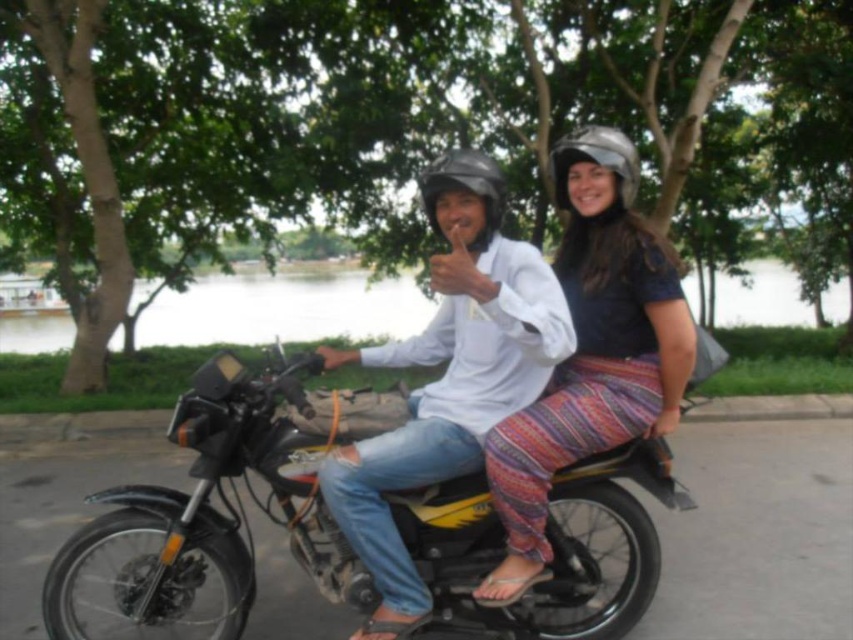
Question: Can you confirm if black matte motorcycle at center is positioned to the right of matte black helmet at center?

Choices:
 (A) no
 (B) yes

Answer: (A)

Question: Which of the following is the farthest from the observer?

Choices:
 (A) multicolored woven pants at center
 (B) black matte motorcycle at center
 (C) white matte shirt at center
 (D) matte black helmet at center

Answer: (D)

Question: Does black matte motorcycle at center appear under metallic silver helmet at upper right?

Choices:
 (A) yes
 (B) no

Answer: (A)

Question: Which of the following is the farthest from the observer?

Choices:
 (A) metallic silver helmet at upper right
 (B) black matte motorcycle at center
 (C) white matte shirt at center
 (D) matte black helmet at center

Answer: (A)

Question: Which object is the closest to the multicolored woven pants at center?

Choices:
 (A) black matte motorcycle at center
 (B) white matte shirt at center
 (C) matte black helmet at center
 (D) metallic silver helmet at upper right

Answer: (B)

Question: Is black matte motorcycle at center to the right of multicolored woven pants at center from the viewer's perspective?

Choices:
 (A) yes
 (B) no

Answer: (B)